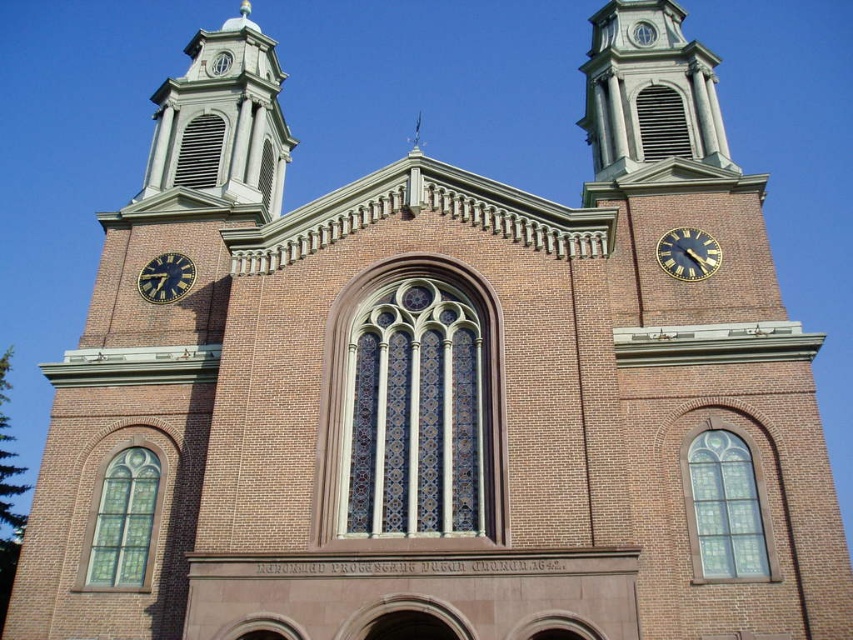
Does point (712, 253) lie in front of point (177, 280)?

Yes, it is in front of point (177, 280).

Is point (656, 252) farther from camera compared to point (160, 285)?

That is False.

Identify the location of gold metallic clock at upper right. (688, 253).